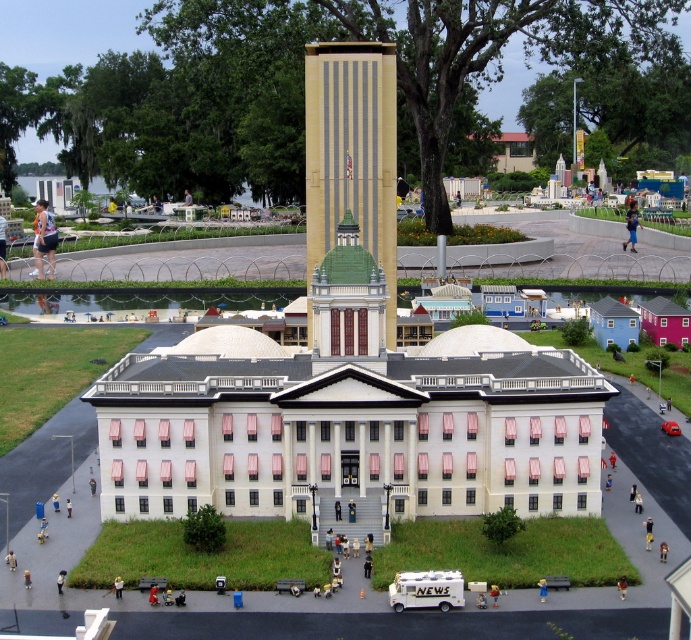
Question: Among these points, which one is nearest to the camera?

Choices:
 (A) (39, 224)
 (B) (321, 193)

Answer: (B)

Question: Can you confirm if beige textured tower at center is thinner than matte black shorts at lower left?

Choices:
 (A) no
 (B) yes

Answer: (A)

Question: Does beige textured tower at center have a larger size compared to matte black shorts at lower left?

Choices:
 (A) no
 (B) yes

Answer: (B)

Question: Can you confirm if matte black shorts at lower left is positioned above light blue jeans at center?

Choices:
 (A) yes
 (B) no

Answer: (B)

Question: Which point is farther from the camera taking this photo?

Choices:
 (A) (305, 80)
 (B) (37, 250)
 (C) (0, 250)

Answer: (C)

Question: Among these objects, which one is farthest from the camera?

Choices:
 (A) matte black shorts at lower left
 (B) light blue jeans at center

Answer: (B)